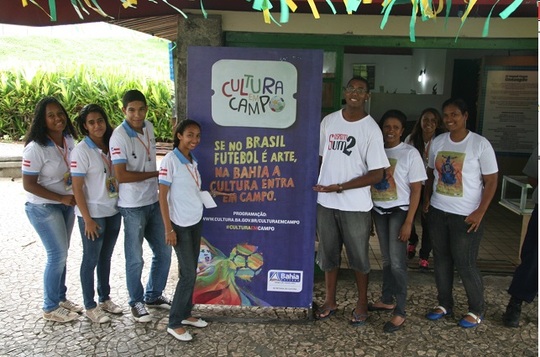
Where is `sign on wall`? The width and height of the screenshot is (540, 357). sign on wall is located at coordinates (514, 111).